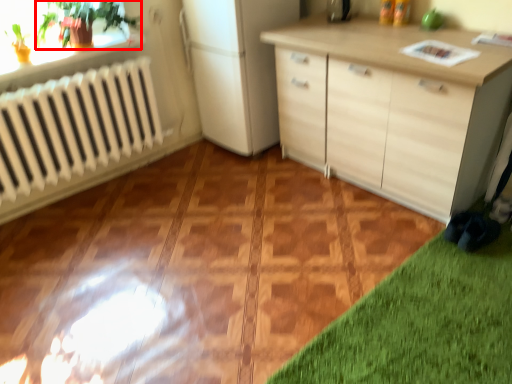
Question: In this image, where is plant (annotated by the red box) located relative to appliance?

Choices:
 (A) left
 (B) right

Answer: (A)